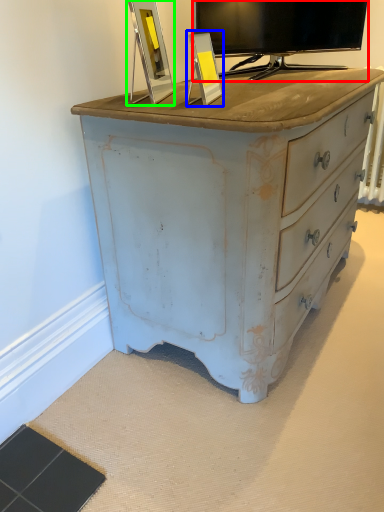
Question: Considering the real-world distances, which object is farthest from television (highlighted by a red box)? picture frame (highlighted by a blue box) or picture frame (highlighted by a green box)?

Choices:
 (A) picture frame
 (B) picture frame

Answer: (A)